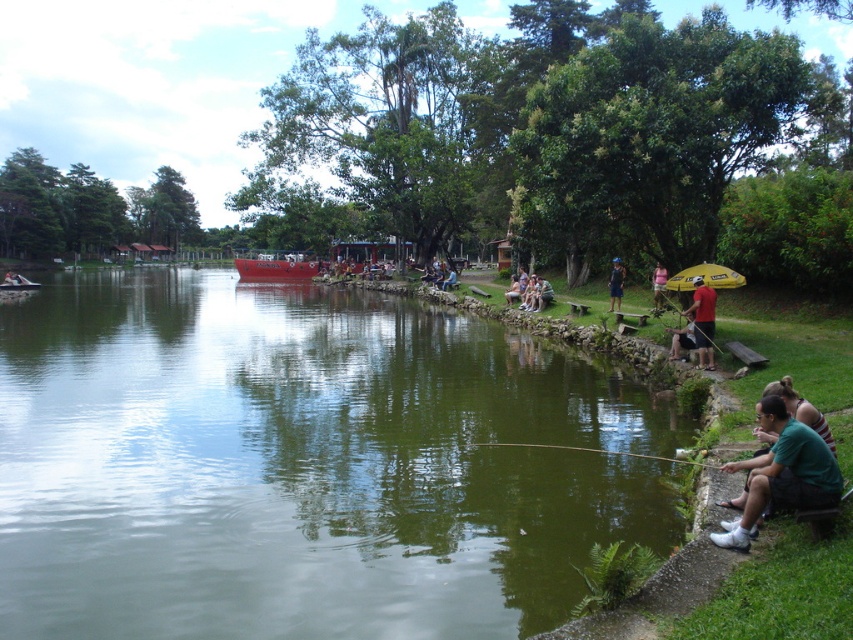
Question: Which object appears farthest from the camera in this image?

Choices:
 (A) green smooth water at center
 (B) pink fabric shirt at right
 (C) wooden fishing pole at lower center

Answer: (B)

Question: Which point is closer to the camera?

Choices:
 (A) (12, 282)
 (B) (654, 291)
 (C) (1, 588)
 (D) (712, 273)

Answer: (C)

Question: Can you confirm if green cotton shirt at lower right is bigger than red matte shirt at right?

Choices:
 (A) yes
 (B) no

Answer: (B)

Question: Is the position of green smooth water at center more distant than that of green cotton shirt at lower right?

Choices:
 (A) no
 (B) yes

Answer: (B)

Question: Estimate the real-world distances between objects in this image. Which object is closer to the blue fabric shirt at center-right?

Choices:
 (A) red matte shirt at right
 (B) yellow fabric umbrella at right

Answer: (B)

Question: In this image, where is green smooth water at center located relative to yellow fabric umbrella at right?

Choices:
 (A) left
 (B) right

Answer: (A)